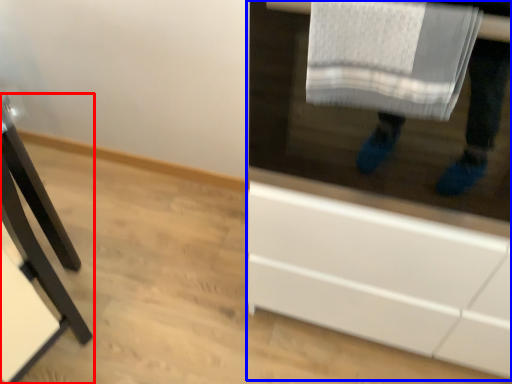
Question: Which object is further to the camera taking this photo, furniture (highlighted by a red box) or cabinetry (highlighted by a blue box)?

Choices:
 (A) furniture
 (B) cabinetry

Answer: (A)